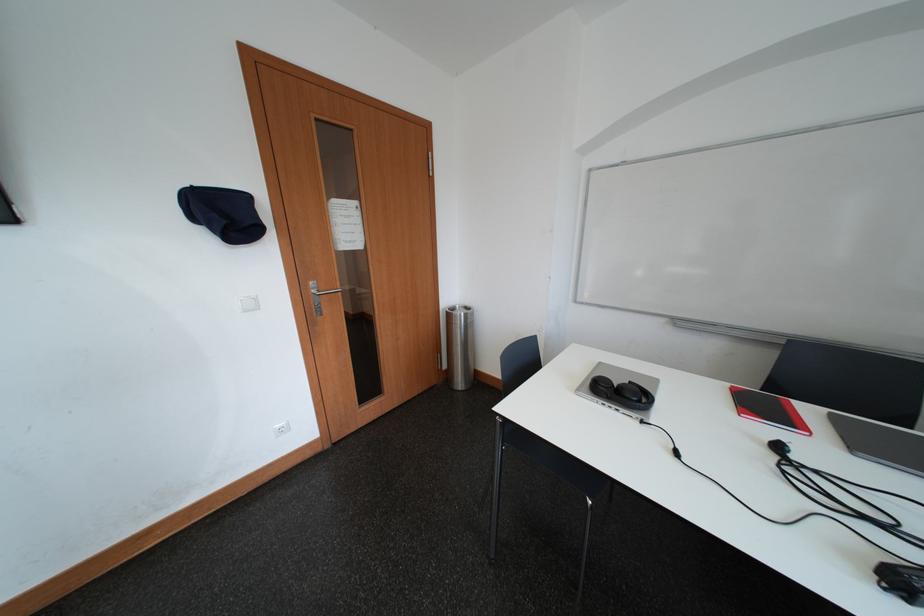
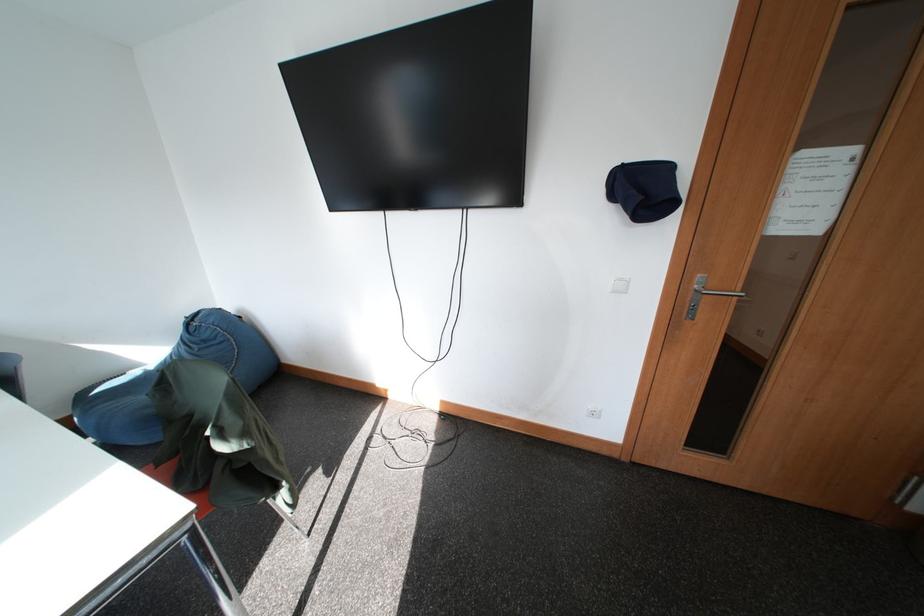
The point at (x=319, y=289) is marked in the first image. Where is the corresponding point in the second image?

(703, 282)